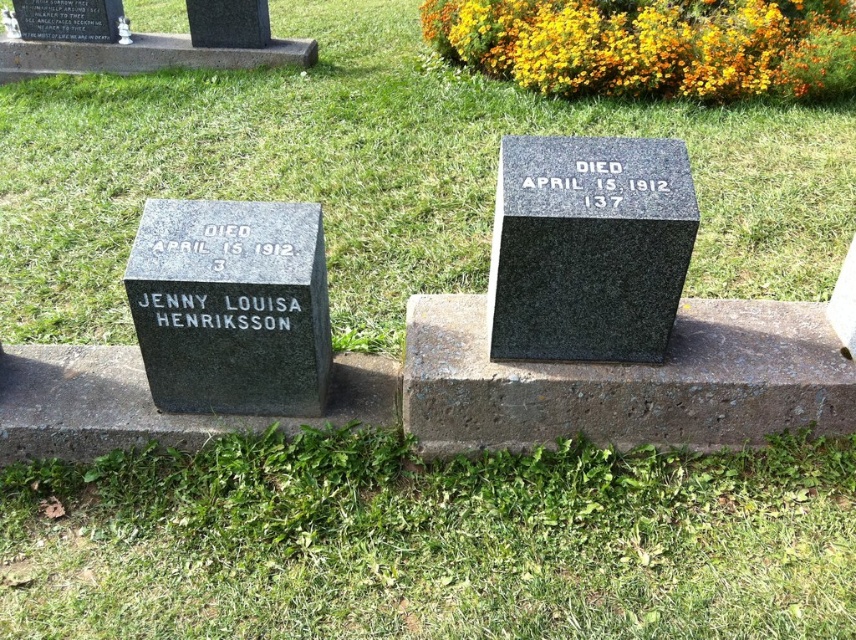
You are a gardener who needs to mow the lawn. Looking at the image, will the lawnmower be able to pass between the green grass at lower center and the black granite gravestone at center without hitting the gravestone?

The green grass at lower center is shorter than the black granite gravestone at center, so the lawnmower can pass between them as long as it avoids the base of the gravestone.

You are a gardener who needs to mow the lawn in the cemetery. You see the green grass at center and the black granite gravestone at center. Which area requires more attention for mowing?

The green grass at center requires more attention for mowing since it occupies less space than the black granite gravestone at center, which cannot be mowed.

You are standing in a cemetery and notice the green grass at center and the granite gravestone at left. Which object is located closer to the front of the image?

The green grass at center is positioned over granite gravestone at left, so it is closer to the front of the image.